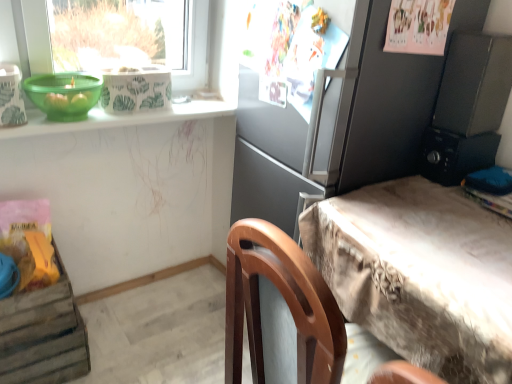
Question: Does wooden crate at lower left have a larger size compared to green plastic bowl at upper left?

Choices:
 (A) yes
 (B) no

Answer: (A)

Question: From the image's perspective, is wooden crate at lower left located beneath green plastic bowl at upper left?

Choices:
 (A) yes
 (B) no

Answer: (A)

Question: Can you confirm if wooden crate at lower left is positioned to the left of green plastic bowl at upper left?

Choices:
 (A) no
 (B) yes

Answer: (B)

Question: From a real-world perspective, is wooden crate at lower left under green plastic bowl at upper left?

Choices:
 (A) yes
 (B) no

Answer: (A)

Question: Is wooden crate at lower left further to camera compared to green plastic bowl at upper left?

Choices:
 (A) no
 (B) yes

Answer: (B)

Question: Visually, is textured beige desk at right positioned to the left or to the right of green plastic bowl at upper left?

Choices:
 (A) right
 (B) left

Answer: (A)

Question: From a real-world perspective, relative to green plastic bowl at upper left, is textured beige desk at right vertically above or below?

Choices:
 (A) below
 (B) above

Answer: (A)

Question: Is textured beige desk at right inside or outside of green plastic bowl at upper left?

Choices:
 (A) inside
 (B) outside

Answer: (B)

Question: Is textured beige desk at right bigger or smaller than green plastic bowl at upper left?

Choices:
 (A) big
 (B) small

Answer: (A)

Question: From a real-world perspective, is green plastic bowl at upper left physically located above or below matte gray refrigerator at center?

Choices:
 (A) below
 (B) above

Answer: (B)

Question: In terms of size, does green plastic bowl at upper left appear bigger or smaller than matte gray refrigerator at center?

Choices:
 (A) small
 (B) big

Answer: (A)

Question: In terms of height, does green plastic bowl at upper left look taller or shorter compared to matte gray refrigerator at center?

Choices:
 (A) tall
 (B) short

Answer: (B)

Question: Is point (233, 112) positioned closer to the camera than point (241, 112)?

Choices:
 (A) closer
 (B) farther

Answer: (B)

Question: From a real-world perspective, is matte gray refrigerator at center physically located above or below black plastic radio at upper right?

Choices:
 (A) below
 (B) above

Answer: (A)

Question: From the image's perspective, is matte gray refrigerator at center above or below black plastic radio at upper right?

Choices:
 (A) below
 (B) above

Answer: (A)